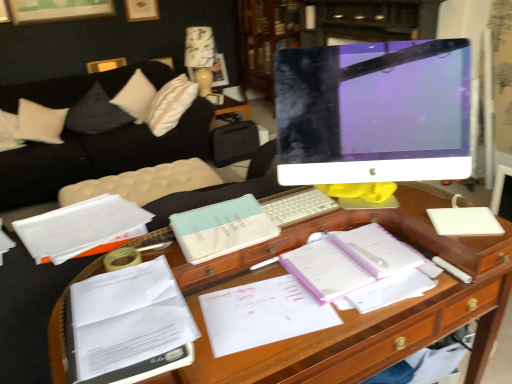
What do you see at coordinates (262, 314) in the screenshot? This screenshot has width=512, height=384. I see `white paper at center` at bounding box center [262, 314].

Describe the element at coordinates (264, 39) in the screenshot. This screenshot has width=512, height=384. I see `wooden bookshelf at upper center` at that location.

In order to click on patterned fabric lampshade at upper center in this screenshot , I will do `click(201, 56)`.

Locate an element on the screen. white plastic keyboard at center is located at coordinates (298, 206).

Where is `purple spiral notebook at center`? The image size is (512, 384). purple spiral notebook at center is located at coordinates (349, 261).

The image size is (512, 384). I want to click on white paper at center, so click(x=262, y=314).

How many degrees apart are the facing directions of white paper at lower left, which is counted as the first book, starting from the front, and white paper at left, the first book from the back?

The angle between the facing direction of white paper at lower left, which is counted as the first book, starting from the front, and the facing direction of white paper at left, the first book from the back, is 88.9 degrees.

Is white paper at lower left, which ranks as the 3th book in back-to-front order, wider than white paper at left, which appears as the 3th book when viewed from the front?

No.

Would you consider white paper at lower left, which is counted as the first book, starting from the front, to be distant from white paper at left, the first book from the back?

No, white paper at lower left, which is counted as the first book, starting from the front, is not far away from white paper at left, the first book from the back.

Is white paper at left, the first book from the back, surrounded by white paper at lower left, which ranks as the 3th book in back-to-front order?

No, white paper at left, the first book from the back, is not inside white paper at lower left, which ranks as the 3th book in back-to-front order.

From the image's perspective, which is above, wooden desk at center or black fabric pillow at left, marked as the first pillow in a left-to-right arrangement?

black fabric pillow at left, marked as the first pillow in a left-to-right arrangement, from the image's perspective.

Can you confirm if wooden desk at center is positioned to the right of black fabric pillow at left, marked as the first pillow in a left-to-right arrangement?

Yes.

Find the location of `pillow that is the 1st object above the wooden desk at center (from a real-world perspective)`. pillow that is the 1st object above the wooden desk at center (from a real-world perspective) is located at coordinates (96, 113).

Is purple spiral notebook at center closer to the viewer compared to white soft pillow at upper left, placed as the first pillow when sorted from right to left?

Yes, it is in front of white soft pillow at upper left, placed as the first pillow when sorted from right to left.

From a real-world perspective, is purple spiral notebook at center positioned above or below white soft pillow at upper left, placed as the first pillow when sorted from right to left?

Clearly, from a real-world perspective, purple spiral notebook at center is above white soft pillow at upper left, placed as the first pillow when sorted from right to left.

Is purple spiral notebook at center positioned beyond the bounds of white soft pillow at upper left, placed as the first pillow when sorted from right to left?

Absolutely, purple spiral notebook at center is external to white soft pillow at upper left, placed as the first pillow when sorted from right to left.

From the image's perspective, is purple spiral notebook at center positioned above or below white soft pillow at upper left, placed as the first pillow when sorted from right to left?

From the image's perspective, purple spiral notebook at center appears below white soft pillow at upper left, placed as the first pillow when sorted from right to left.

From a real-world perspective, is wooden bookshelf at upper center physically located above or below purple spiral notebook at center?

Clearly, from a real-world perspective, wooden bookshelf at upper center is below purple spiral notebook at center.

Is wooden bookshelf at upper center in contact with purple spiral notebook at center?

No, wooden bookshelf at upper center is not touching purple spiral notebook at center.

Could purple spiral notebook at center be considered to be inside wooden bookshelf at upper center?

No.

Is white paper at center taller or shorter than wooden bookshelf at upper center?

Considering their sizes, white paper at center has less height than wooden bookshelf at upper center.

You are a GUI agent. You are given a task and a screenshot of the screen. Output one action in this format:
    pyautogui.click(x=<x>, y=<y>)
    Task: Click on the document below the wooden bookshelf at upper center (from the image's perspective)
    This screenshot has height=384, width=512.
    Given the screenshot: What is the action you would take?
    pyautogui.click(x=262, y=314)

In the scene shown: Which point is more forward, (256, 327) or (279, 12)?

The point (256, 327) is closer to the camera.

Is white paper at center wider than wooden bookshelf at upper center?

Incorrect, the width of white paper at center does not surpass that of wooden bookshelf at upper center.

From a real-world perspective, between wooden desk at center and patterned fabric lampshade at upper center, who is vertically lower?

wooden desk at center, from a real-world perspective.

How many degrees apart are the facing directions of wooden desk at center and patterned fabric lampshade at upper center?

The angular difference between wooden desk at center and patterned fabric lampshade at upper center is 90.7 degrees.

Does point (489, 292) appear closer or farther from the camera than point (211, 74)?

Point (489, 292) is positioned closer to the camera compared to point (211, 74).

Is wooden desk at center bigger or smaller than patterned fabric lampshade at upper center?

In the image, wooden desk at center appears to be larger than patterned fabric lampshade at upper center.

Is black fabric pillow at left, marked as the second pillow in a right-to-left arrangement, situated inside white glossy computer monitor at center or outside?

black fabric pillow at left, marked as the second pillow in a right-to-left arrangement, is not enclosed by white glossy computer monitor at center.

Considering the sizes of objects black fabric pillow at left, marked as the first pillow in a left-to-right arrangement, and white glossy computer monitor at center in the image provided, who is smaller, black fabric pillow at left, marked as the first pillow in a left-to-right arrangement, or white glossy computer monitor at center?

Smaller between the two is white glossy computer monitor at center.

Does point (89, 130) appear closer or farther from the camera than point (424, 176)?

Clearly, point (89, 130) is more distant from the camera than point (424, 176).

Considering the positions of objects black fabric pillow at left, marked as the second pillow in a right-to-left arrangement, and white glossy computer monitor at center in the image provided, who is more to the left, black fabric pillow at left, marked as the second pillow in a right-to-left arrangement, or white glossy computer monitor at center?

From the viewer's perspective, black fabric pillow at left, marked as the second pillow in a right-to-left arrangement, appears more on the left side.

This screenshot has height=384, width=512. Find the location of `the 1st book directly above the white paper at left, which appears as the 3th book when viewed from the front (from a real-world perspective)`. the 1st book directly above the white paper at left, which appears as the 3th book when viewed from the front (from a real-world perspective) is located at coordinates (129, 325).

The image size is (512, 384). What are the coordinates of `desk beneath the black fabric pillow at left, marked as the first pillow in a left-to-right arrangement (from a real-world perspective)` in the screenshot? It's located at (352, 311).

From the picture: When comparing their distances from white paper at left, which appears as the 3th book when viewed from the front, does white plastic keyboard at center or black fabric pillow at left, marked as the first pillow in a left-to-right arrangement, seem further?

black fabric pillow at left, marked as the first pillow in a left-to-right arrangement, is positioned further to the anchor white paper at left, which appears as the 3th book when viewed from the front.

Looking at this image, based on their spatial positions, is white paper at center or white soft pillow at upper left, placed as the first pillow when sorted from right to left, closer to light blue matte notebook at center, which is the second book from front to back?

white paper at center lies closer to light blue matte notebook at center, which is the second book from front to back, than the other object.

Which object lies nearer to the anchor point purple spiral notebook at center, white plastic keyboard at center or light blue matte notebook at center, which is the second book from front to back?

Based on the image, white plastic keyboard at center appears to be nearer to purple spiral notebook at center.

Looking at the image, which one is located closer to wooden desk at center, white paper at lower left, which ranks as the 3th book in back-to-front order, or white plastic keyboard at center?

white paper at lower left, which ranks as the 3th book in back-to-front order.

Based on their spatial positions, is white plastic keyboard at center or white soft pillow at upper left, which ranks as the 2th pillow in left-to-right order, closer to white paper at center?

white plastic keyboard at center is positioned closer to the anchor white paper at center.

Based on their spatial positions, is white paper at left, the first book from the back, or white soft pillow at upper left, which ranks as the 2th pillow in left-to-right order, further from patterned fabric lampshade at upper center?

Based on the image, white paper at left, the first book from the back, appears to be further to patterned fabric lampshade at upper center.

From the image, which object appears to be nearer to white glossy computer monitor at center, white plastic keyboard at center or purple spiral notebook at center?

white plastic keyboard at center.

In the scene shown: From the image, which object appears to be nearer to white paper at center, white glossy computer monitor at center or light blue matte notebook at center, acting as the second book starting from the back?

Based on the image, light blue matte notebook at center, acting as the second book starting from the back, appears to be nearer to white paper at center.

The width and height of the screenshot is (512, 384). I want to click on computer keyboard located between light blue matte notebook at center, which is the second book from front to back, and white soft pillow at upper left, placed as the first pillow when sorted from right to left, in the depth direction, so click(x=298, y=206).

Locate an element on the screen. The image size is (512, 384). notebook between white paper at lower left, which is counted as the first book, starting from the front, and white glossy computer monitor at center is located at coordinates (349, 261).

Identify the location of computer keyboard between wooden desk at center and patterned fabric lampshade at upper center from front to back. The image size is (512, 384). (298, 206).

Identify the location of document between white paper at lower left, which is counted as the first book, starting from the front, and white plastic keyboard at center from front to back. This screenshot has width=512, height=384. (262, 314).